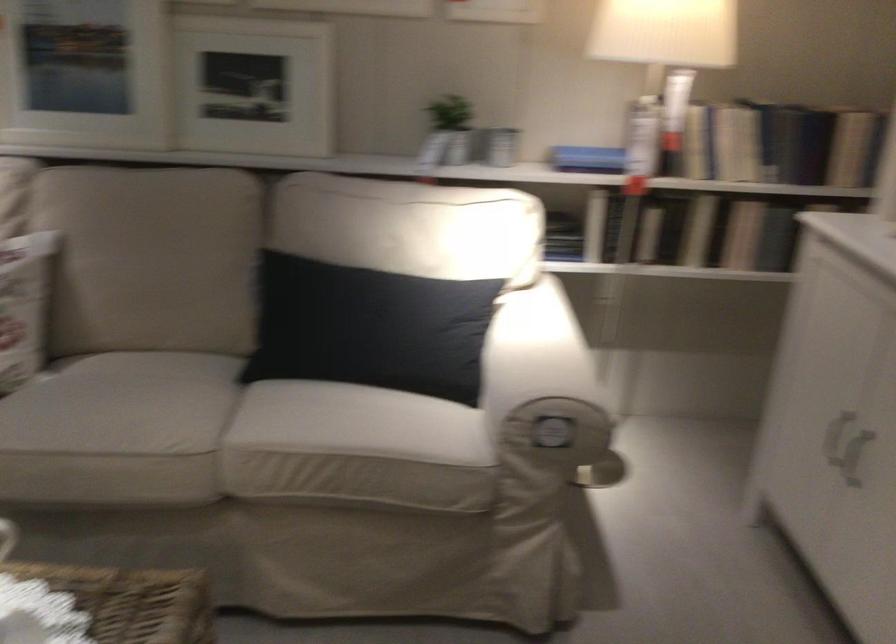
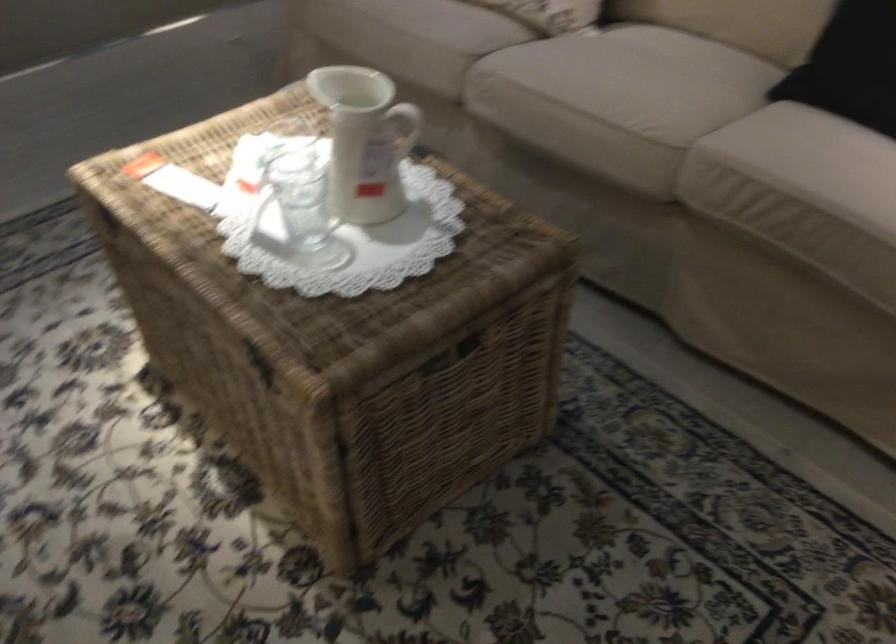
Consider the image. The first image is from the beginning of the video and the second image is from the end. How did the camera likely rotate when shooting the video?

The camera's rotation is toward left-down.